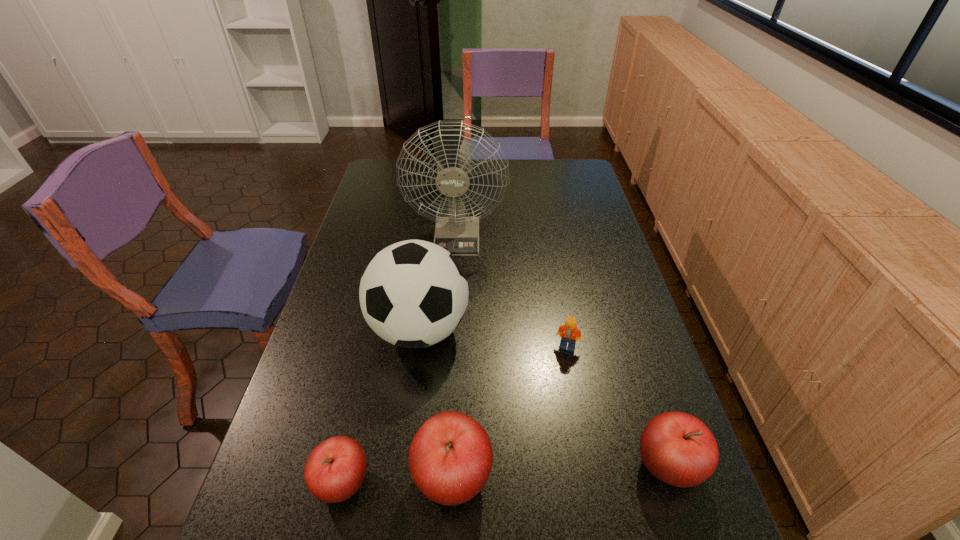
The height and width of the screenshot is (540, 960). Identify the location of the shortest apple. (334, 471).

In order to click on the second apple from right to left in this screenshot , I will do `click(450, 458)`.

At what (x,y) coordinates should I click in order to perform the action: click on the second tallest apple. Please return your answer as a coordinate pair (x, y). The width and height of the screenshot is (960, 540). Looking at the image, I should click on (677, 448).

This screenshot has height=540, width=960. I want to click on the rightmost object, so click(x=677, y=448).

Image resolution: width=960 pixels, height=540 pixels. Identify the location of the second tallest object. (413, 294).

Find the location of a particular element. fan is located at coordinates (459, 235).

Identify the location of the farthest object. (459, 235).

I want to click on the fifth object from left to right, so [568, 332].

You are a GUI agent. You are given a task and a screenshot of the screen. Output one action in this format:
    pyautogui.click(x=<x>, y=<y>)
    Task: Click on the free spot located on the back of the shortest apple
    
    Given the screenshot: What is the action you would take?
    pyautogui.click(x=362, y=399)

This screenshot has height=540, width=960. I want to click on free spot located 0.210m on the back of the second apple from left to right, so click(x=458, y=363).